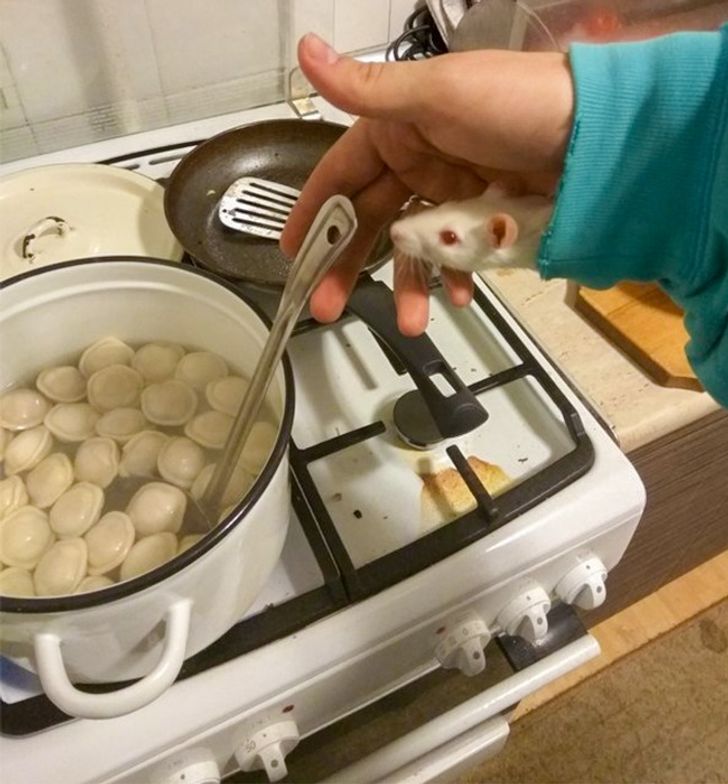
Identify the location of floor. The image size is (728, 784). (589, 735).